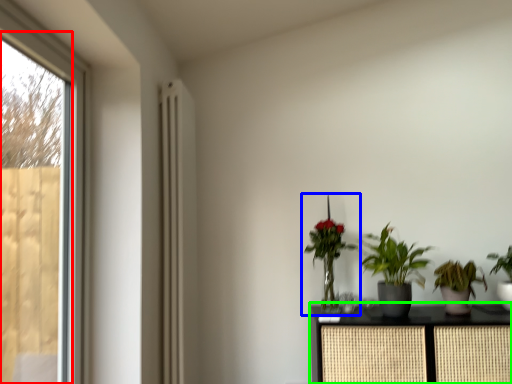
Question: Which is nearer to the screen door (highlighted by a red box)? houseplant (highlighted by a blue box) or furniture (highlighted by a green box).

Choices:
 (A) houseplant
 (B) furniture

Answer: (A)